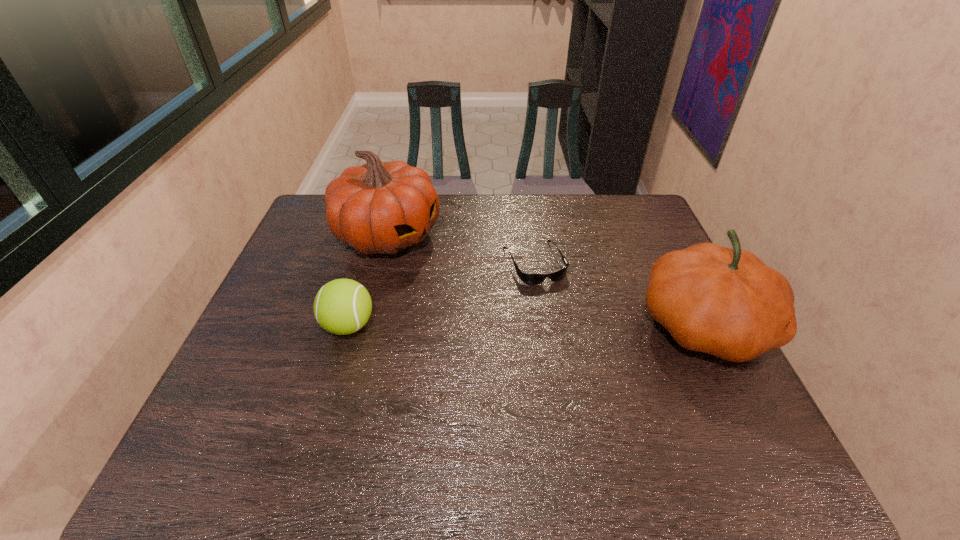
Image resolution: width=960 pixels, height=540 pixels. I want to click on free space on the desktop that is between the tennis ball and the nearer pumpkin and is positioned on the face of the left pumpkin, so click(x=564, y=325).

Where is `vacant spot on the desktop that is between the third tallest object and the rightmost object and is positioned on the front-facing side of the shortest object`? The image size is (960, 540). vacant spot on the desktop that is between the third tallest object and the rightmost object and is positioned on the front-facing side of the shortest object is located at coordinates (567, 325).